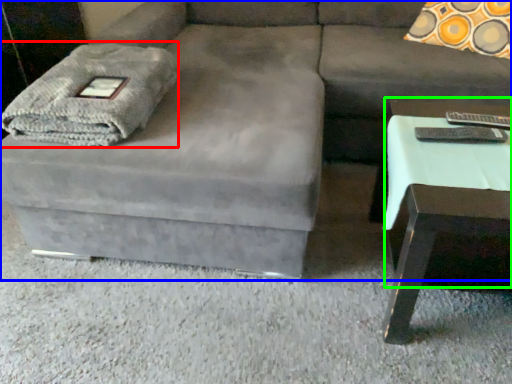
Question: Which is farther away from blanket (highlighted by a red box)? studio couch (highlighted by a blue box) or side table (highlighted by a green box)?

Choices:
 (A) studio couch
 (B) side table

Answer: (B)